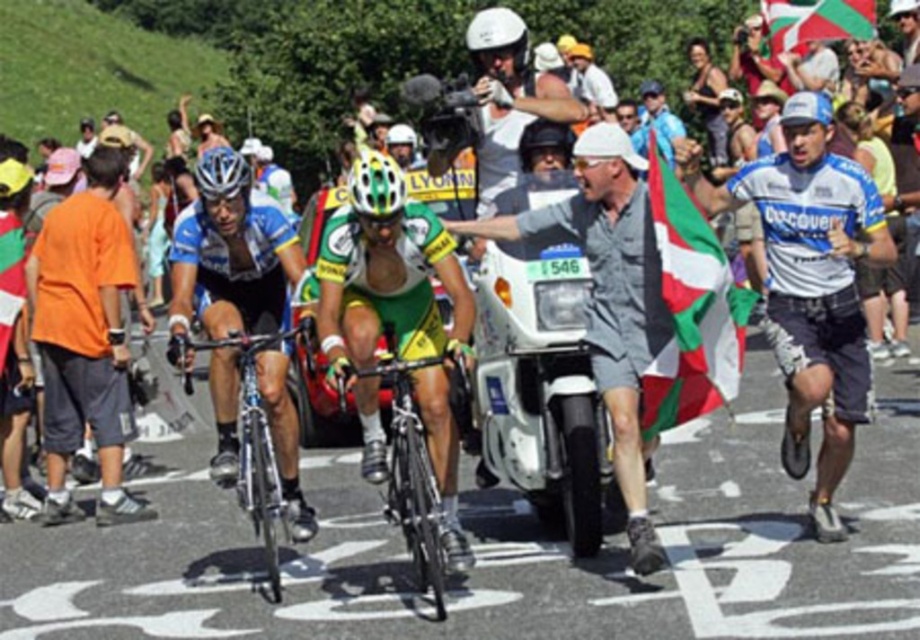
You are a photographer trying to capture the cyclists in the race. You notice the shiny black frame at center and the white matte bicycle helmet at center in your viewfinder. Which object appears shorter in your photo?

The shiny black frame at center appears shorter than the white matte bicycle helmet at center in the photo because it has a lesser height compared to the helmet.